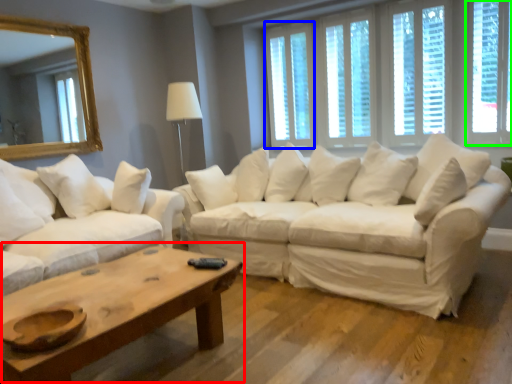
Question: Considering the real-world distances, which object is farthest from coffee table (highlighted by a red box)? window (highlighted by a blue box) or window (highlighted by a green box)?

Choices:
 (A) window
 (B) window

Answer: (B)